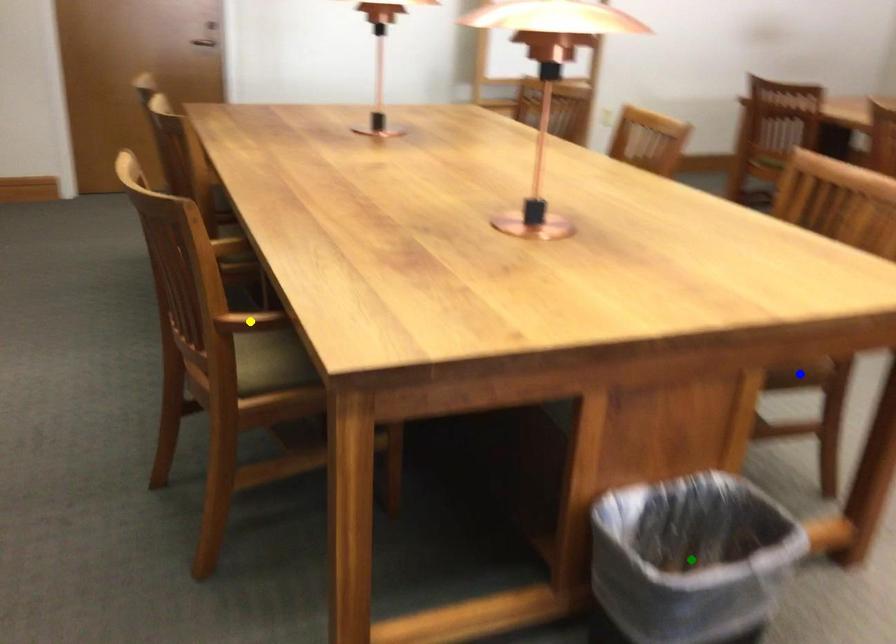
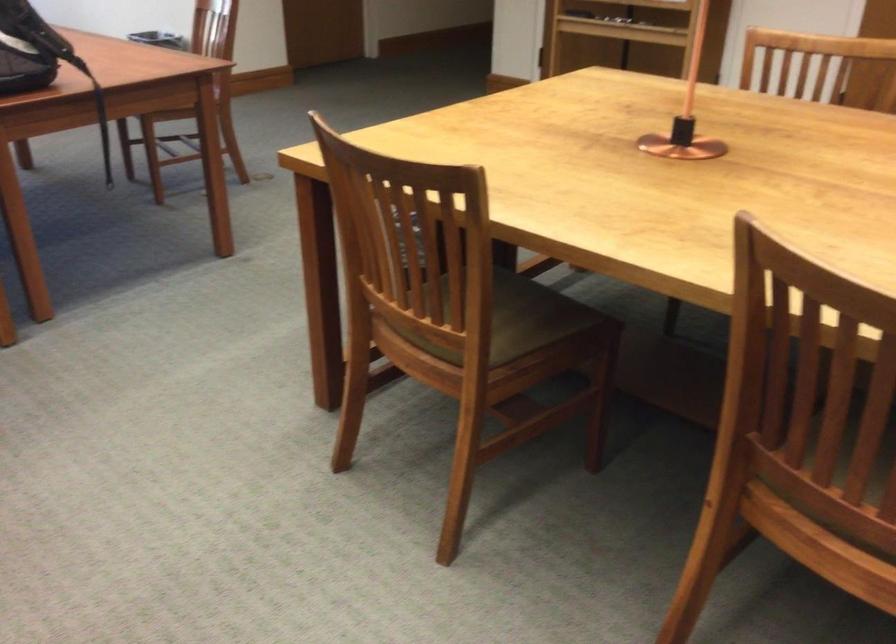
I am providing you with two images of the same scene from different viewpoints. Three points are marked in image1. Which point corresponds to a part or object that is occluded in image2?In image1, three points are marked. Which of them correspond to a part or object that is occluded in image2?Among the three points shown in image1, which one corresponds to a part or object that is no longer visible due to occlusion in image2?

green point, yellow point, blue point